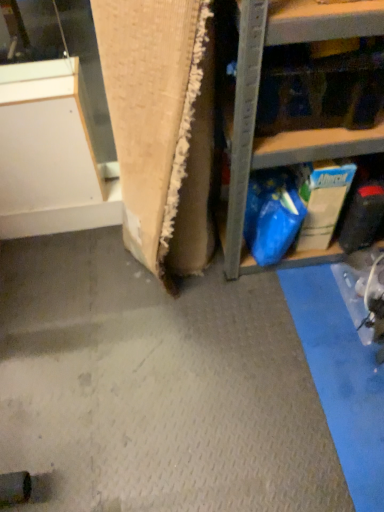
Question: Does white matte cabinet at upper left have a lesser width compared to blue plastic bag at upper right?

Choices:
 (A) no
 (B) yes

Answer: (B)

Question: Is white matte cabinet at upper left in contact with blue plastic bag at upper right?

Choices:
 (A) no
 (B) yes

Answer: (A)

Question: Is white matte cabinet at upper left facing away from blue plastic bag at upper right?

Choices:
 (A) no
 (B) yes

Answer: (A)

Question: From a real-world perspective, is white matte cabinet at upper left physically below blue plastic bag at upper right?

Choices:
 (A) no
 (B) yes

Answer: (B)

Question: Would you say blue plastic bag at upper right is part of white matte cabinet at upper left's contents?

Choices:
 (A) no
 (B) yes

Answer: (A)

Question: From the image's perspective, is white matte cabinet at upper left over blue plastic bag at upper right?

Choices:
 (A) no
 (B) yes

Answer: (A)

Question: Is blue plastic bag at upper right turned away from white matte cabinet at upper left?

Choices:
 (A) yes
 (B) no

Answer: (B)

Question: Can you confirm if blue plastic bag at upper right is thinner than white matte cabinet at upper left?

Choices:
 (A) yes
 (B) no

Answer: (B)

Question: Considering the relative sizes of blue plastic bag at upper right and white matte cabinet at upper left in the image provided, is blue plastic bag at upper right bigger than white matte cabinet at upper left?

Choices:
 (A) no
 (B) yes

Answer: (B)

Question: Is blue plastic bag at upper right completely or partially outside of white matte cabinet at upper left?

Choices:
 (A) yes
 (B) no

Answer: (A)

Question: Are blue plastic bag at upper right and white matte cabinet at upper left beside each other?

Choices:
 (A) no
 (B) yes

Answer: (A)

Question: Is blue plastic bag at upper right surrounding white matte cabinet at upper left?

Choices:
 (A) no
 (B) yes

Answer: (A)

Question: Based on their sizes in the image, would you say blue plastic bag at upper right is bigger or smaller than white matte cabinet at upper left?

Choices:
 (A) small
 (B) big

Answer: (B)